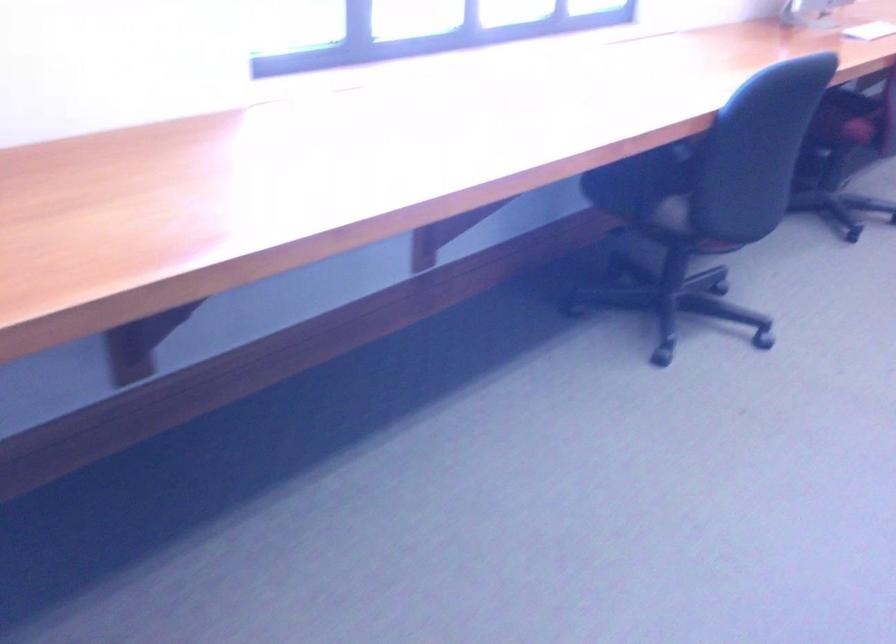
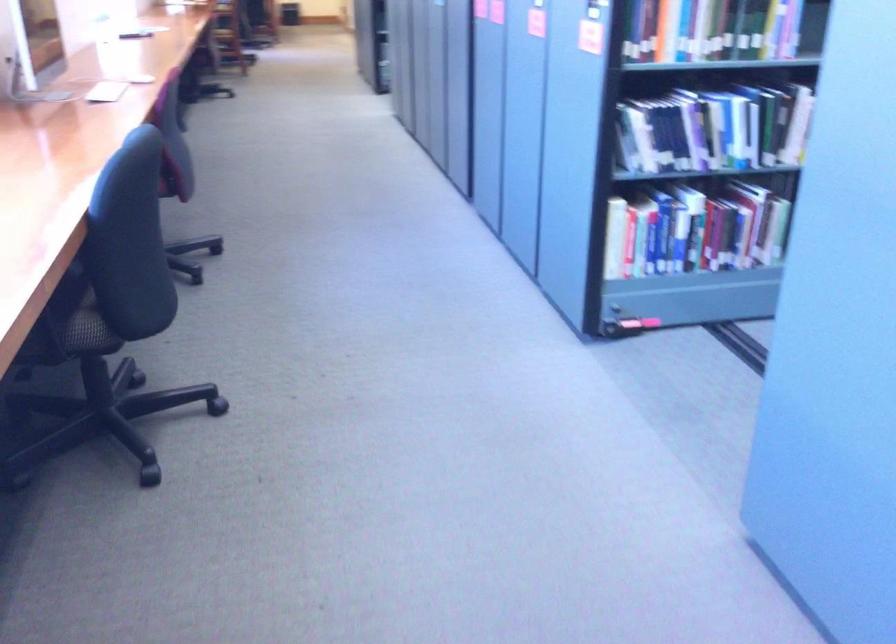
Question: How did the camera likely rotate?

Choices:
 (A) Left
 (B) Right
 (C) Up
 (D) Down

Answer: (B)